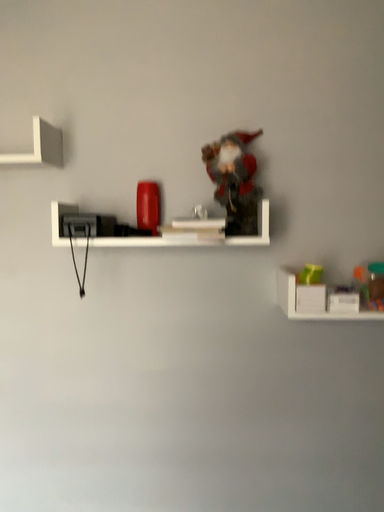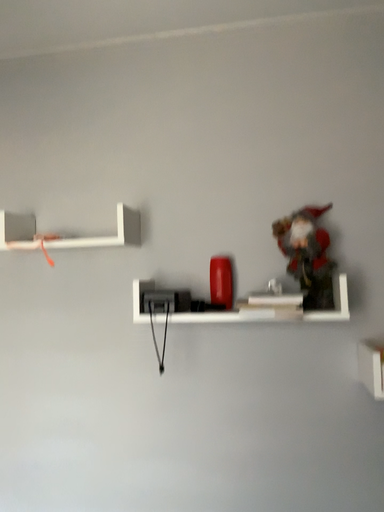
Question: How did the camera likely rotate when shooting the video?

Choices:
 (A) rotated upward
 (B) rotated downward

Answer: (A)